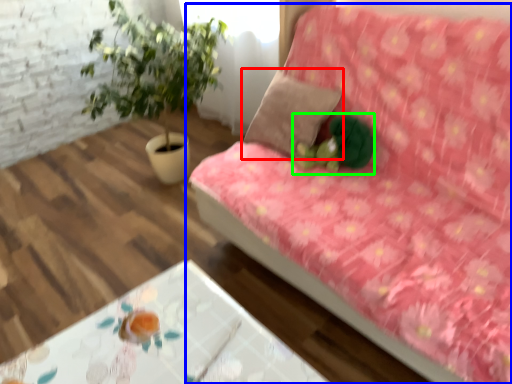
Question: Based on their relative distances, which object is farther from pillow (highlighted by a red box)? Choose from studio couch (highlighted by a blue box) and toy (highlighted by a green box).

Choices:
 (A) studio couch
 (B) toy

Answer: (A)